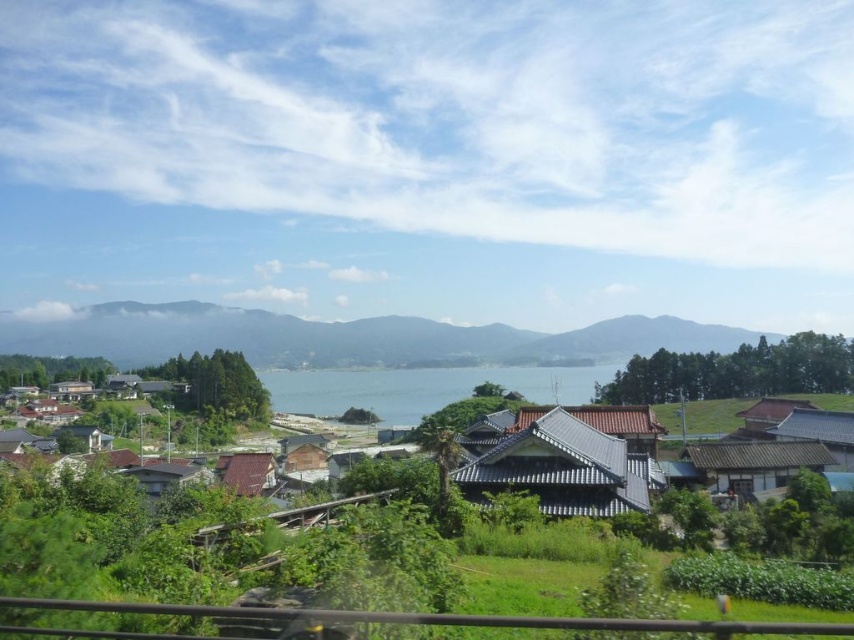
You are standing at the edge of the brown tile roof at lower left and want to climb up to the green grassy hillside at center. Is the hillside higher than the roof?

The green grassy hillside at center is taller than brown tile roof at lower left, so yes, the hillside is higher than the roof.

You are standing at the point marked as point (343, 337) in the image. Looking around, what is the most prominent feature directly in front of you?

The green grassy hillside at center is located at point (343, 337), so the most prominent feature directly in front of you is the green grassy hillside at center.

You are standing in the village and want to take a photo of the brown tiled roofs at center and the brown tile roof at lower left. Which one should you point your camera towards if you want to capture the one that is positioned to the right side of the other?

You should point your camera towards the brown tile roof at lower left because the brown tiled roofs at center are to the left of it, meaning the brown tile roof at lower left is positioned to the right side of the brown tiled roofs at center.